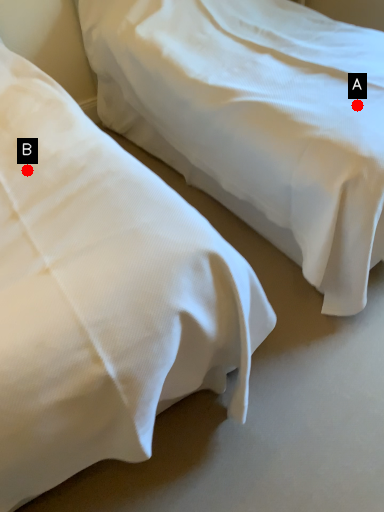
Question: Two points are circled on the image, labeled by A and B beside each circle. Which point is closer to the camera?

Choices:
 (A) A is closer
 (B) B is closer

Answer: (B)